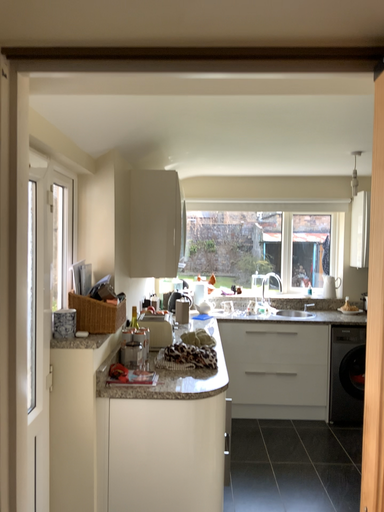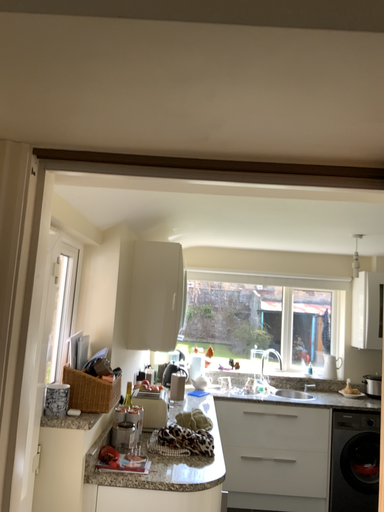
Question: Which way did the camera rotate in the video?

Choices:
 (A) rotated downward
 (B) rotated upward

Answer: (B)